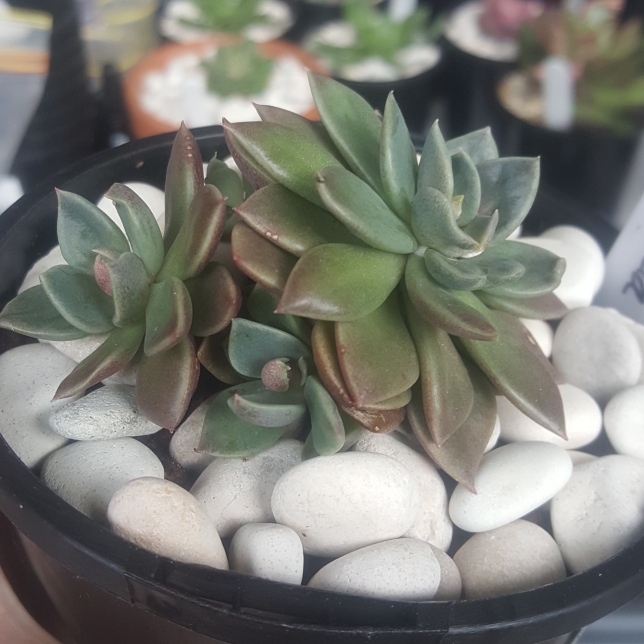
Where is `brown pot`? Image resolution: width=644 pixels, height=644 pixels. brown pot is located at coordinates (140, 120).